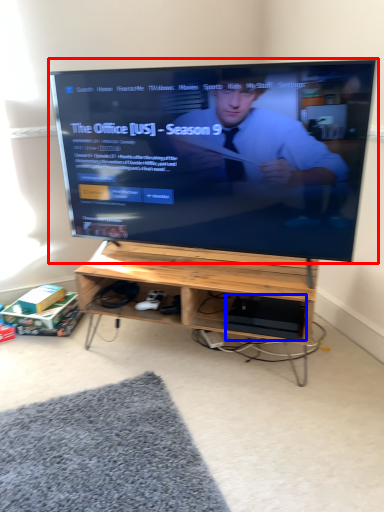
Question: Which point is further to the camera, television (highlighted by a red box) or computer (highlighted by a blue box)?

Choices:
 (A) television
 (B) computer

Answer: (B)